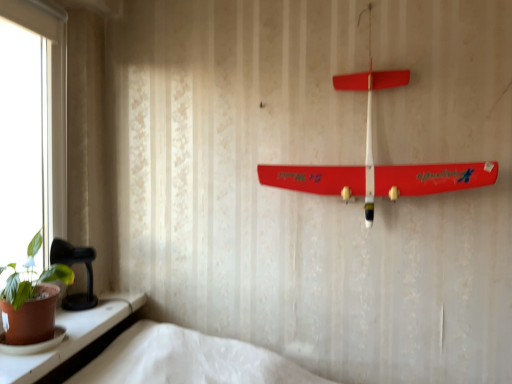
Question: Looking at the image, does smooth plastic airplane at upper center seem bigger or smaller compared to green matte houseplant at lower left?

Choices:
 (A) big
 (B) small

Answer: (A)

Question: Considering the positions of point (495, 162) and point (34, 244), is point (495, 162) closer or farther from the camera than point (34, 244)?

Choices:
 (A) farther
 (B) closer

Answer: (B)

Question: Estimate the real-world distances between objects in this image. Which object is closer to the green matte houseplant at lower left?

Choices:
 (A) smooth plastic airplane at upper center
 (B) matte white window sill at lower left

Answer: (B)

Question: Which is farther from the matte white window sill at lower left?

Choices:
 (A) smooth plastic airplane at upper center
 (B) green matte houseplant at lower left

Answer: (A)